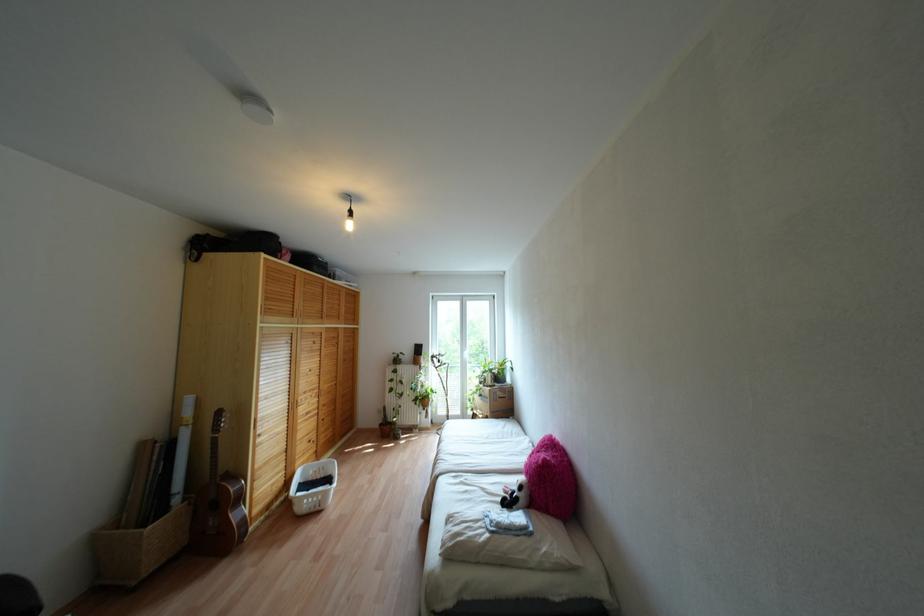
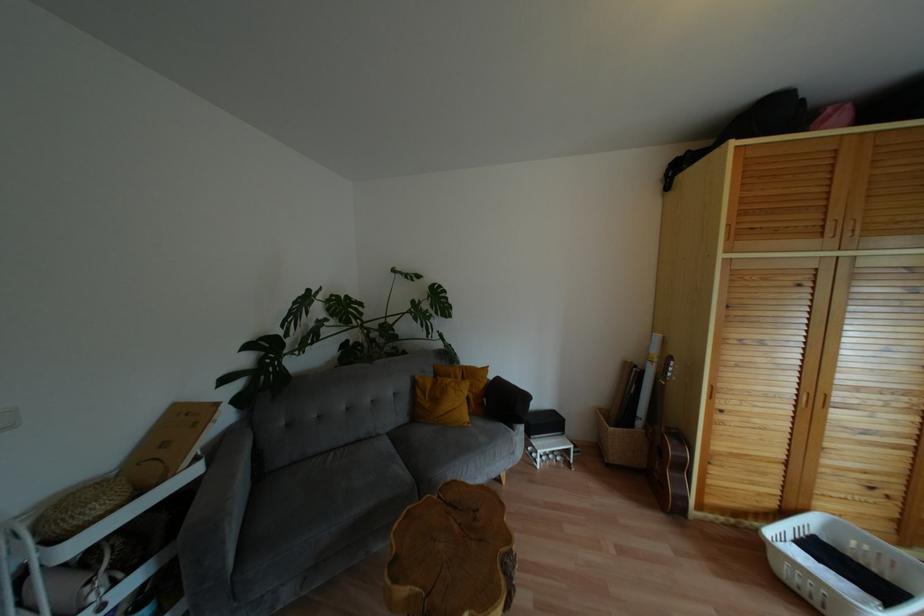
Question: Based on the continuous images, in which direction is the camera rotating? Reply with the corresponding letter.

Choices:
 (A) Left
 (B) Right
 (C) Up
 (D) Down

Answer: (A)